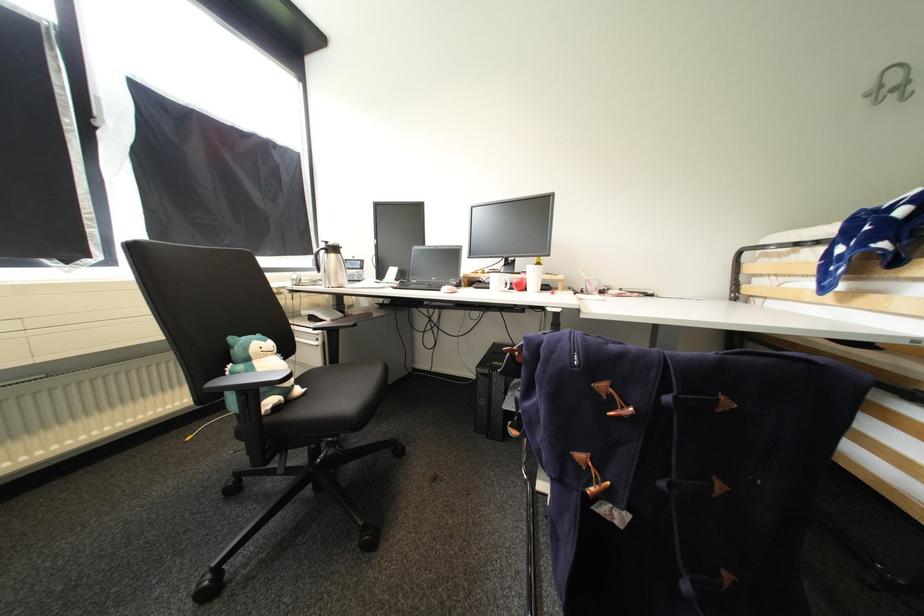
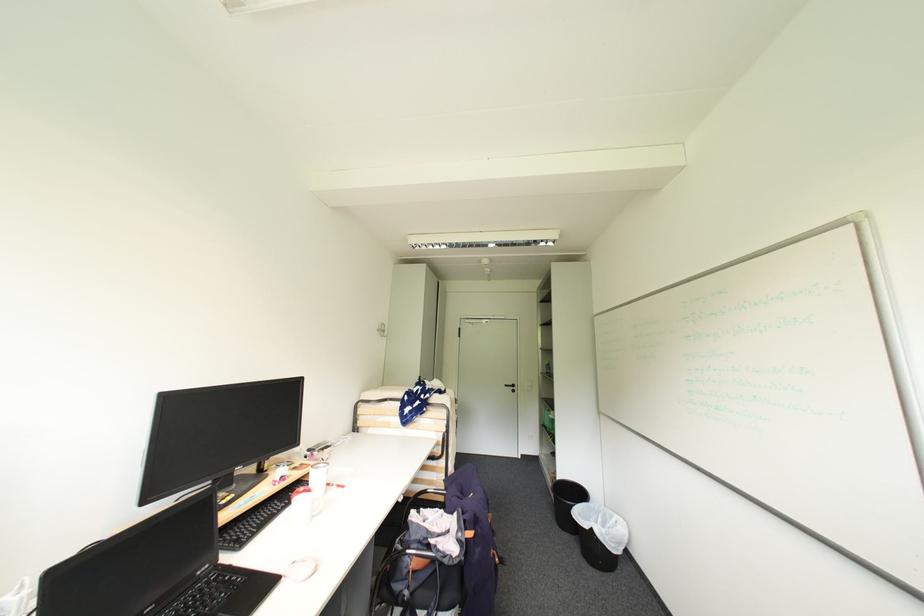
Find the pixel in the second image that matches point (556, 310) in the first image.

(407, 501)